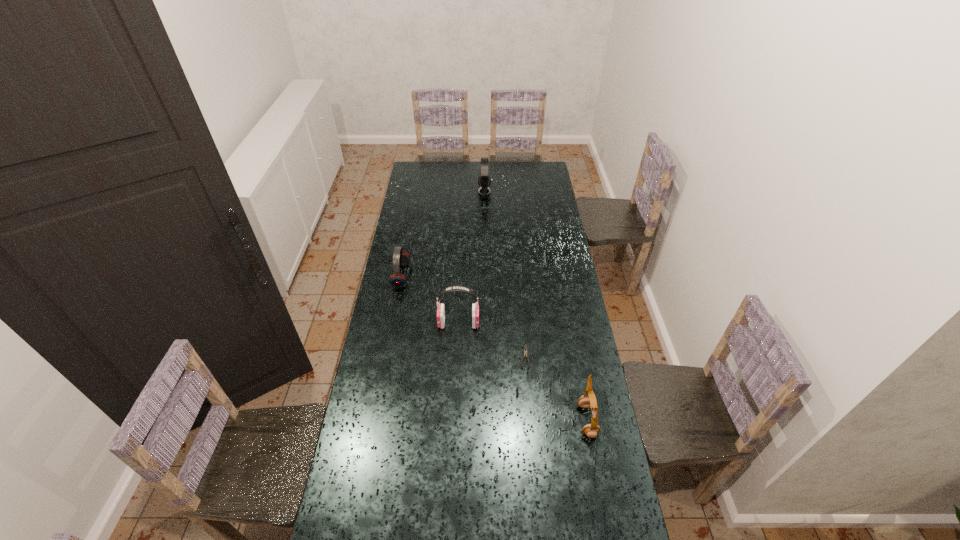
Find the location of a particular element. The height and width of the screenshot is (540, 960). vacant area situated 0.230m on the ear cups of the farthest earphone is located at coordinates [439, 191].

Identify the location of free space located on the ear cups of the farthest earphone. The height and width of the screenshot is (540, 960). (463, 191).

Where is `vacant position located on the front-facing side of the nearest object`? This screenshot has height=540, width=960. vacant position located on the front-facing side of the nearest object is located at coordinates (539, 420).

Identify the location of vacant position located 0.070m on the front-facing side of the nearest object. This screenshot has height=540, width=960. (559, 420).

You are a GUI agent. You are given a task and a screenshot of the screen. Output one action in this format:
    pyautogui.click(x=<x>, y=<y>)
    Task: Click on the vacant area situated on the front-facing side of the nearest object
    
    Given the screenshot: What is the action you would take?
    [505, 420]

This screenshot has height=540, width=960. I want to click on vacant area located on the ear cups of the second shortest object, so click(488, 276).

Locate an element on the screen. vacant area situated on the front of the pliers is located at coordinates (531, 426).

Image resolution: width=960 pixels, height=540 pixels. What are the coordinates of `object present at the left edge` in the screenshot? It's located at (397, 280).

You are a GUI agent. You are given a task and a screenshot of the screen. Output one action in this format:
    pyautogui.click(x=<x>, y=<y>)
    Task: Click on the object at the right edge
    The height and width of the screenshot is (540, 960).
    Given the screenshot: What is the action you would take?
    pyautogui.click(x=588, y=399)

Where is `vacant point at the far edge`? vacant point at the far edge is located at coordinates (513, 174).